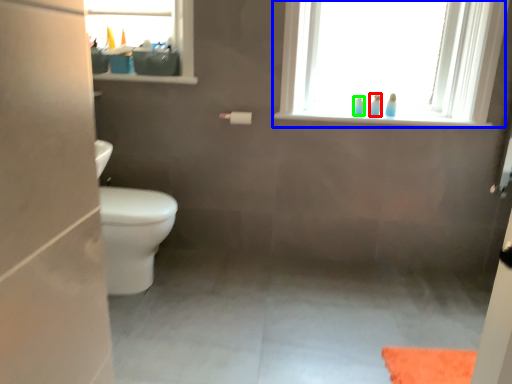
Question: Which is nearer to the toiletry (highlighted by a red box)? window (highlighted by a blue box) or toiletry (highlighted by a green box).

Choices:
 (A) window
 (B) toiletry

Answer: (B)